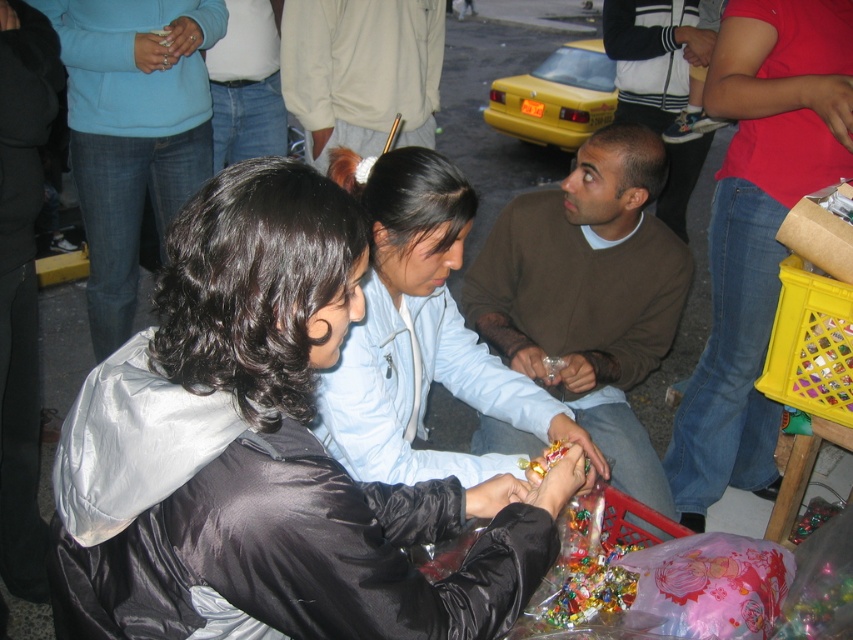
Question: Can you confirm if silky black jacket at center is positioned to the left of denim jeans at lower right?

Choices:
 (A) yes
 (B) no

Answer: (A)

Question: Which point appears closest to the camera in this image?

Choices:
 (A) (310, 24)
 (B) (357, 211)
 (C) (556, 138)
 (D) (508, 467)

Answer: (B)

Question: Based on their relative distances, which object is nearer to the light beige sweater at center?

Choices:
 (A) denim jeans at lower right
 (B) silky black jacket at lower left
 (C) brown sweater at center

Answer: (B)

Question: Which point is farther to the camera?

Choices:
 (A) (729, 292)
 (B) (401, 506)

Answer: (A)

Question: Is silky black jacket at center positioned in front of yellow matte taxi at upper center?

Choices:
 (A) no
 (B) yes

Answer: (B)

Question: In this image, where is denim jeans at lower right located relative to light beige sweater at center?

Choices:
 (A) above
 (B) below

Answer: (B)